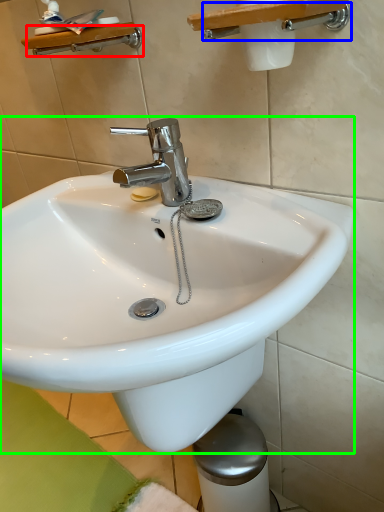
Question: Estimate the real-world distances between objects in this image. Which object is closer to shower (highlighted by a red box), shower (highlighted by a blue box) or sink (highlighted by a green box)?

Choices:
 (A) shower
 (B) sink

Answer: (A)